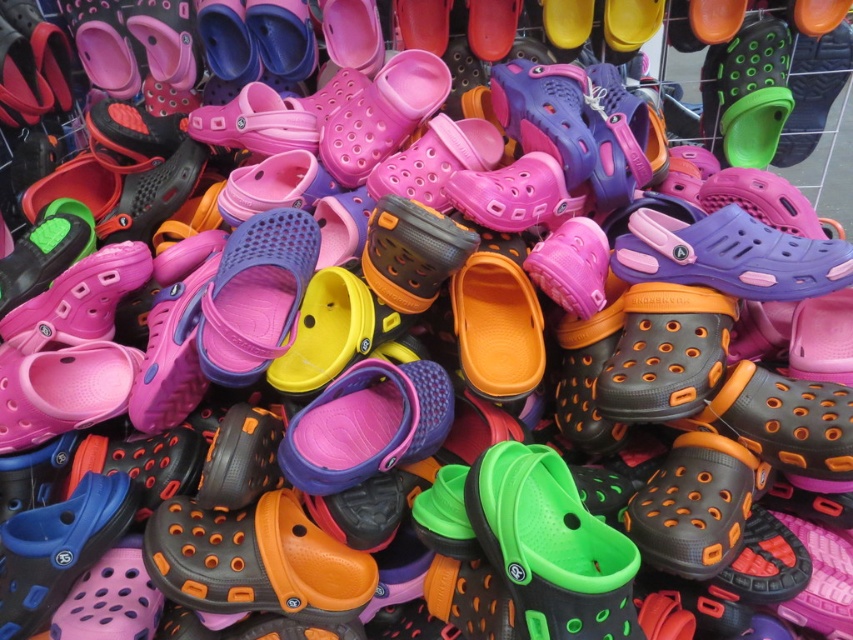
Question: Where is green rubber clog at center located in relation to orange matte clog at center in the image?

Choices:
 (A) right
 (B) left

Answer: (A)

Question: Can you confirm if green rubber clog at center is wider than orange matte clog at center?

Choices:
 (A) no
 (B) yes

Answer: (A)

Question: Does green rubber clog at center appear over orange matte clog at center?

Choices:
 (A) yes
 (B) no

Answer: (A)

Question: Which object is closer to the camera taking this photo?

Choices:
 (A) green rubber clog at center
 (B) orange matte clog at center

Answer: (A)

Question: Which object is farther from the camera taking this photo?

Choices:
 (A) orange matte clog at center
 (B) green rubber clog at center

Answer: (A)